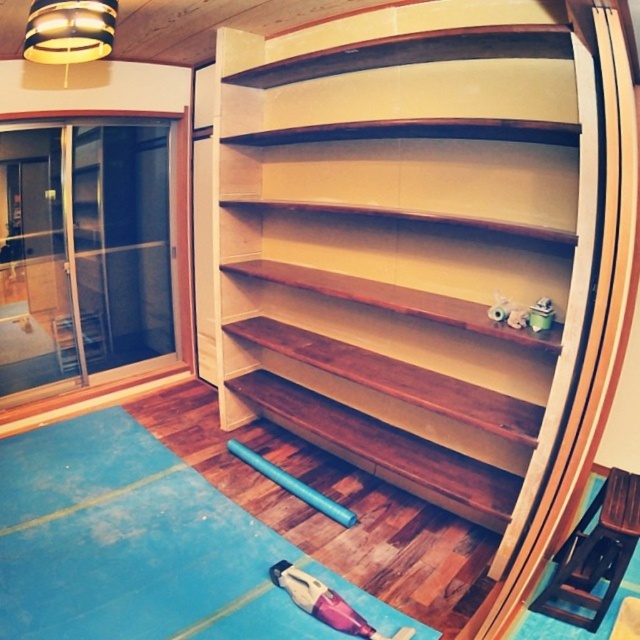
Question: Which point is farther to the camera?

Choices:
 (A) blue rubber mat at lower center
 (B) wooden shelves at center

Answer: (A)

Question: Can you confirm if wooden shelves at center is bigger than blue rubber mat at lower center?

Choices:
 (A) yes
 (B) no

Answer: (A)

Question: Which point is farther to the camera?

Choices:
 (A) blue rubber mat at lower center
 (B) wooden shelves at center

Answer: (A)

Question: Is wooden shelves at center wider than blue rubber mat at lower center?

Choices:
 (A) no
 (B) yes

Answer: (A)

Question: Is wooden shelves at center below blue rubber mat at lower center?

Choices:
 (A) no
 (B) yes

Answer: (A)